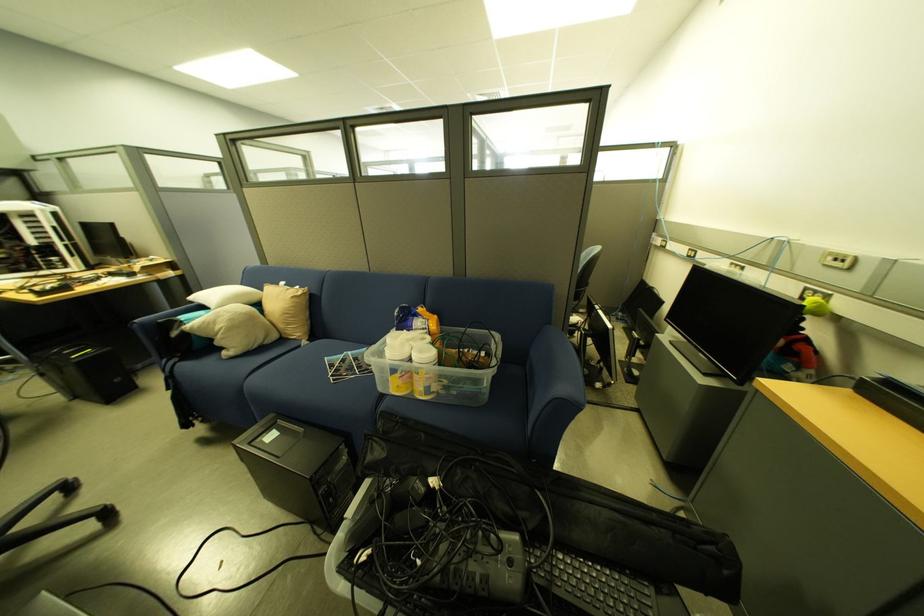
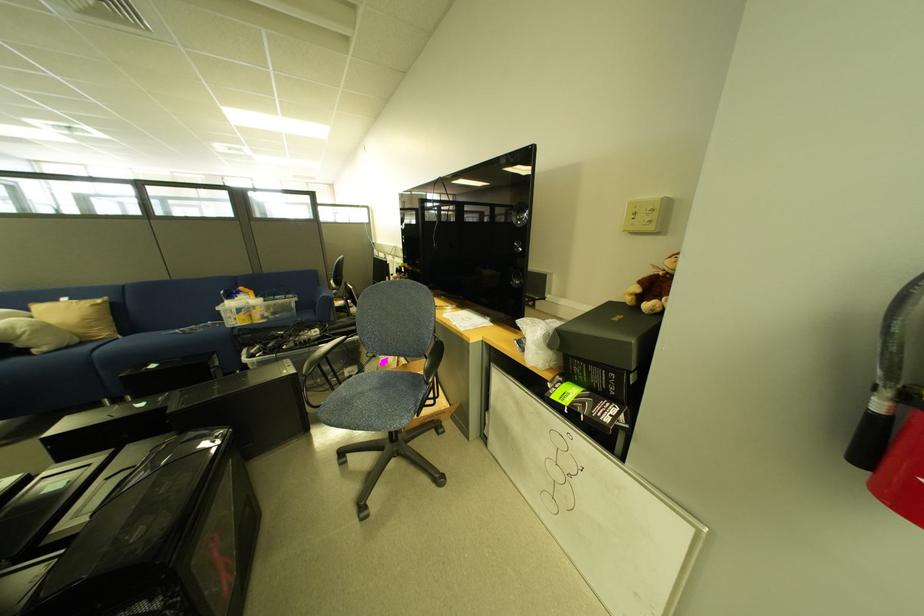
Question: I am providing you with two images of the same scene from different viewpoints. After the viewpoint changes to image2, which objects are now occluded?

Choices:
 (A) sofa sitting surface
 (B) blue chair seat
 (C) plastic storage container
 (D) none of these

Answer: (D)